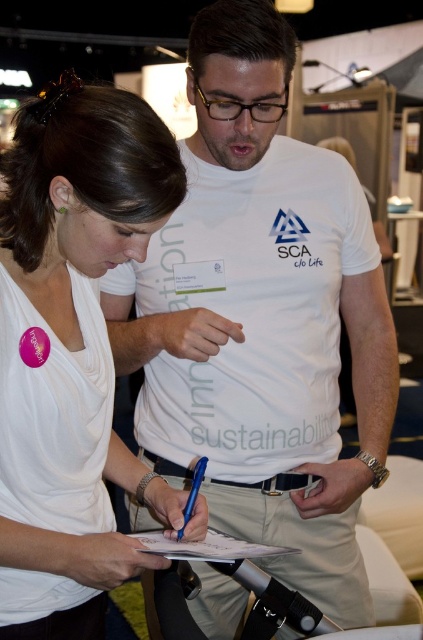
Can you confirm if white paper at center is thinner than blue metallic pen at center?

In fact, white paper at center might be wider than blue metallic pen at center.

Describe the element at coordinates (206, 547) in the screenshot. I see `white paper at center` at that location.

Locate an element on the screen. The width and height of the screenshot is (423, 640). white paper at center is located at coordinates (206, 547).

Is white matte shirt at center positioned in front of blue metallic pen at center?

Yes, it is in front of blue metallic pen at center.

Which of these two, white matte shirt at center or blue metallic pen at center, stands taller?

white matte shirt at center

Find the location of `white matte shirt at center`. white matte shirt at center is located at coordinates (71, 352).

Does white matte shirt at center have a lesser height compared to white paper at center?

Incorrect, white matte shirt at center's height does not fall short of white paper at center's.

Which is more to the left, white matte shirt at center or white paper at center?

white matte shirt at center

Describe the element at coordinates (71, 352) in the screenshot. I see `white matte shirt at center` at that location.

The width and height of the screenshot is (423, 640). In order to click on white matte shirt at center in this screenshot , I will do `click(71, 352)`.